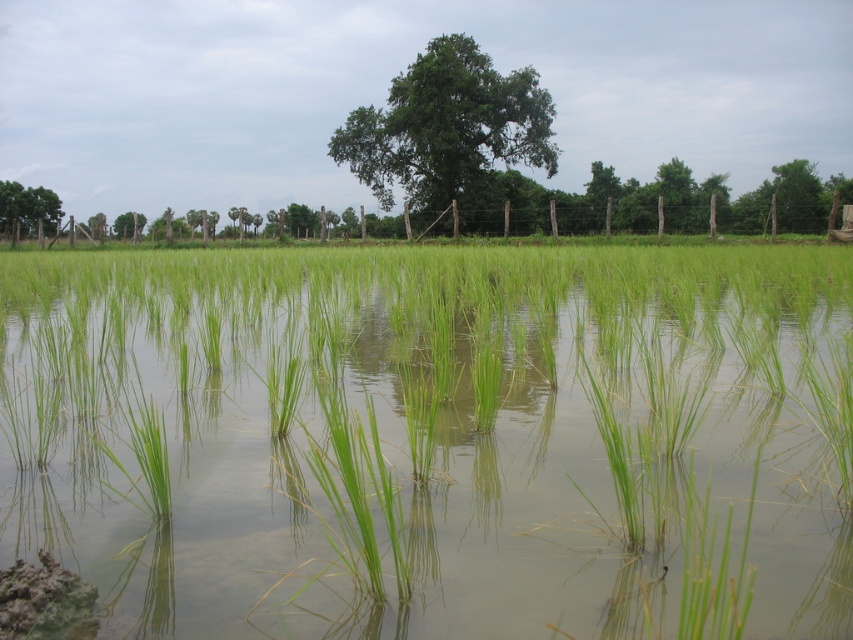
Can you confirm if green grassy rice field at center is smaller than green leafy tree at center?

Correct, green grassy rice field at center occupies less space than green leafy tree at center.

This screenshot has height=640, width=853. What are the coordinates of `green grassy rice field at center` in the screenshot? It's located at (434, 440).

Looking at this image, how far apart are green leafy tree at center and green leafy tree at upper left?

A distance of 22.90 meters exists between green leafy tree at center and green leafy tree at upper left.

Between green leafy tree at center and green leafy tree at upper left, which one is positioned higher?

green leafy tree at center

What do you see at coordinates (447, 125) in the screenshot? I see `green leafy tree at center` at bounding box center [447, 125].

Find the location of a particular element. This screenshot has width=853, height=640. green leafy tree at center is located at coordinates (447, 125).

Who is more distant from viewer, [724,541] or [49,205]?

The point [49,205] is behind.

Measure the distance between green grassy rice field at center and green leafy tree at upper left.

The distance of green grassy rice field at center from green leafy tree at upper left is 130.33 feet.

This screenshot has width=853, height=640. Describe the element at coordinates (434, 440) in the screenshot. I see `green grassy rice field at center` at that location.

I want to click on green grassy rice field at center, so click(x=434, y=440).